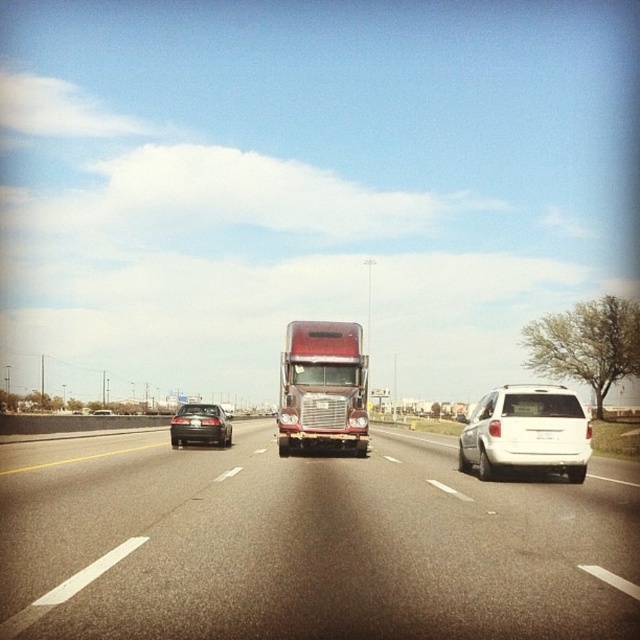
Does shiny black sedan at left appear on the right side of shiny black sedan at center?

Correct, you'll find shiny black sedan at left to the right of shiny black sedan at center.

Locate an element on the screen. The height and width of the screenshot is (640, 640). shiny black sedan at left is located at coordinates (200, 426).

Where is `shiny black sedan at left`? The height and width of the screenshot is (640, 640). shiny black sedan at left is located at coordinates (200, 426).

Does point (541, 404) come in front of point (193, 435)?

Yes, point (541, 404) is closer to viewer.

Between white matte suv at right and shiny black sedan at left, which one appears on the right side from the viewer's perspective?

white matte suv at right is more to the right.

Locate an element on the screen. The height and width of the screenshot is (640, 640). white matte suv at right is located at coordinates (525, 432).

Identify the location of white matte suv at right. The image size is (640, 640). (525, 432).

Is white plastic license plate at center wider than shiny black sedan at center?

No, white plastic license plate at center is not wider than shiny black sedan at center.

Which of these two, white plastic license plate at center or shiny black sedan at center, stands shorter?

Standing shorter between the two is white plastic license plate at center.

Who is more distant from viewer, (541, 436) or (109, 410)?

Point (109, 410)

Find the location of a particular element. Image resolution: width=640 pixels, height=640 pixels. white plastic license plate at center is located at coordinates (545, 435).